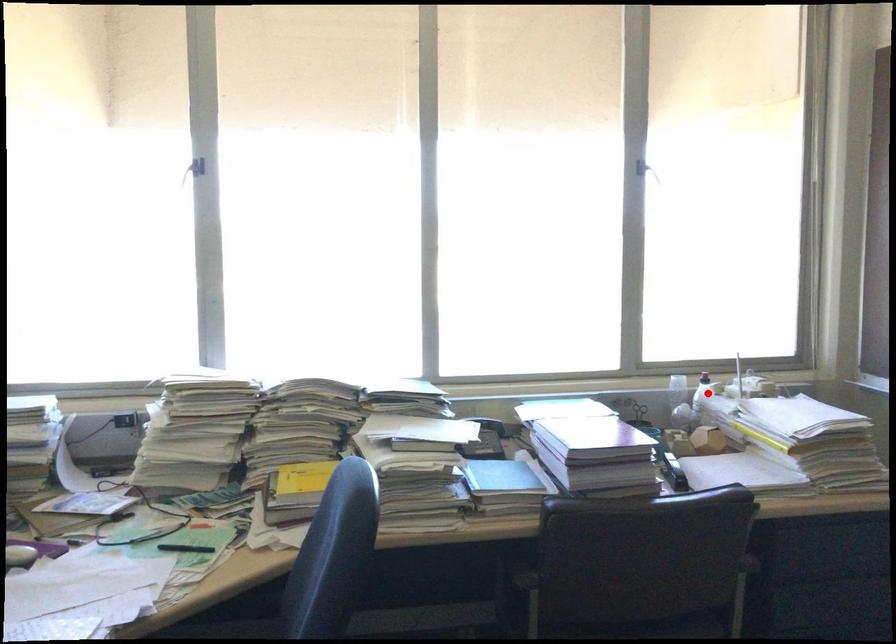
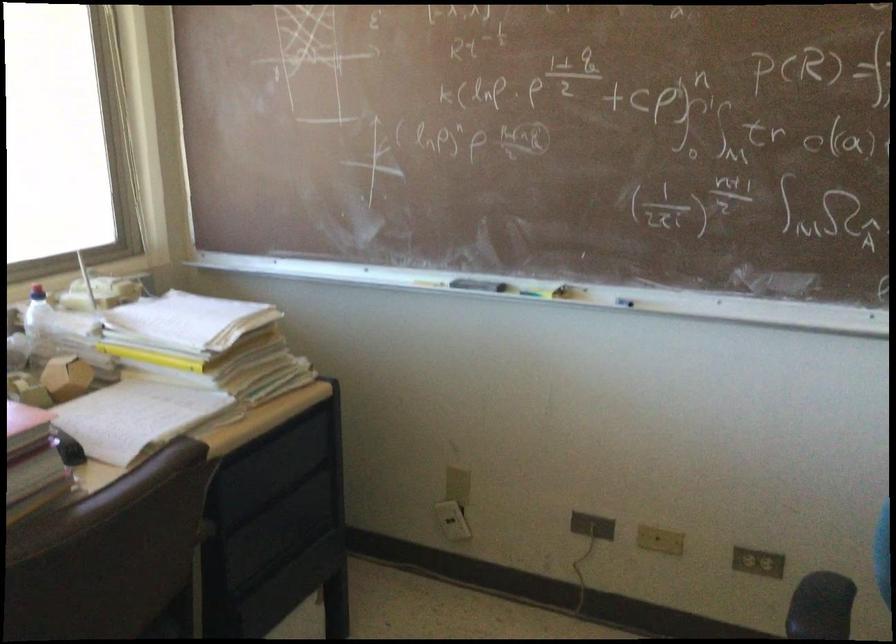
The point at the highlighted location is marked in the first image. Where is the corresponding point in the second image?

(37, 321)